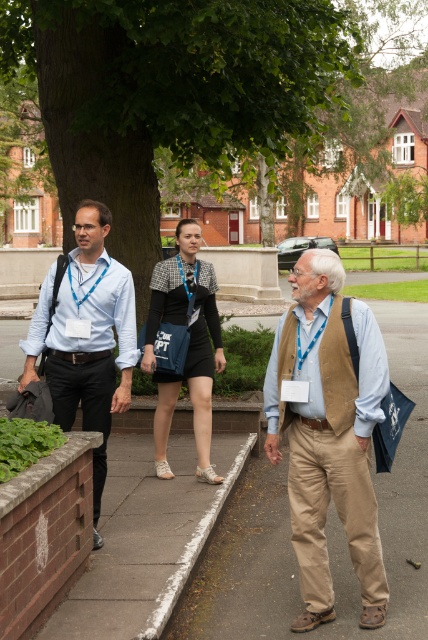
Question: Which of the following is the farthest from the observer?

Choices:
 (A) khaki pants at center
 (B) black textured jacket at center

Answer: (B)

Question: Based on their relative distances, which object is nearer to the white painted concrete curb at lower center?

Choices:
 (A) matte blue shirt at left
 (B) brown asphalt at center
 (C) black textured jacket at center
 (D) green leafy tree at center

Answer: (C)

Question: Which point is closer to the camera?

Choices:
 (A) khaki pants at center
 (B) black textured jacket at center
 (C) matte blue shirt at left

Answer: (A)

Question: Where is green leafy tree at center located in relation to black textured jacket at center in the image?

Choices:
 (A) below
 (B) above

Answer: (B)

Question: Does green leafy tree at center appear under matte blue shirt at left?

Choices:
 (A) yes
 (B) no

Answer: (B)

Question: Does brown asphalt at center have a lesser width compared to khaki pants at center?

Choices:
 (A) yes
 (B) no

Answer: (B)